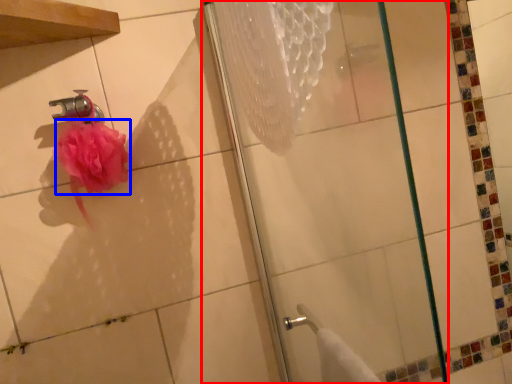
Question: Which object appears closest to the camera in this image, shower (highlighted by a red box) or flower (highlighted by a blue box)?

Choices:
 (A) shower
 (B) flower

Answer: (A)